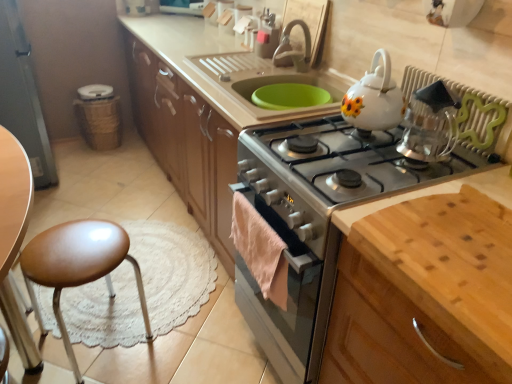
Question: Based on their positions, is brown leather stool at lower left located to the left or right of silver metallic faucet at upper center?

Choices:
 (A) left
 (B) right

Answer: (A)

Question: Considering the positions of brown leather stool at lower left and silver metallic faucet at upper center in the image, is brown leather stool at lower left wider or thinner than silver metallic faucet at upper center?

Choices:
 (A) thin
 (B) wide

Answer: (B)

Question: Considering the real-world distances, which object is closest to the clear glass kettle at upper right?

Choices:
 (A) white glossy teapot at upper right
 (B) silver metallic gas stove at center
 (C) green plastic radiator at upper right
 (D) light brown wood cutting board at lower right
 (E) silver metallic faucet at upper center

Answer: (C)

Question: Which object is positioned closest to the green plastic radiator at upper right?

Choices:
 (A) white glossy teapot at upper right
 (B) brown leather stool at lower left
 (C) clear glass kettle at upper right
 (D) silver metallic faucet at upper center
 (E) silver metallic gas stove at center

Answer: (C)